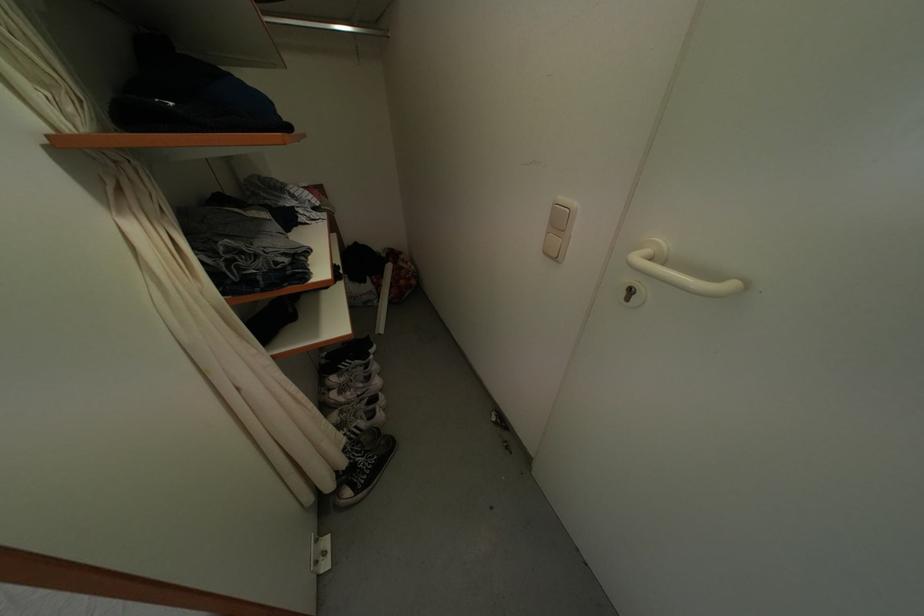
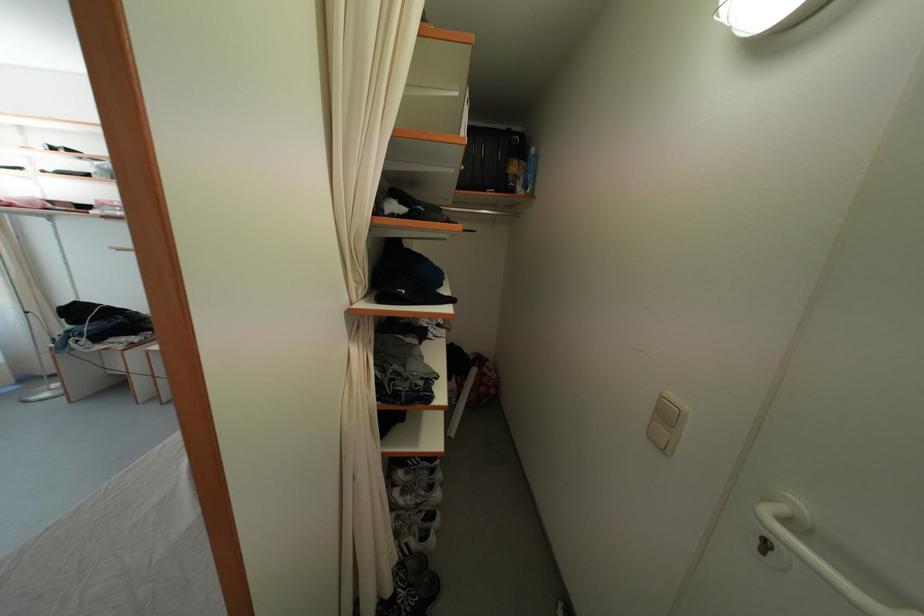
Find the pixel in the second image that matches (565,228) in the first image.

(672, 421)